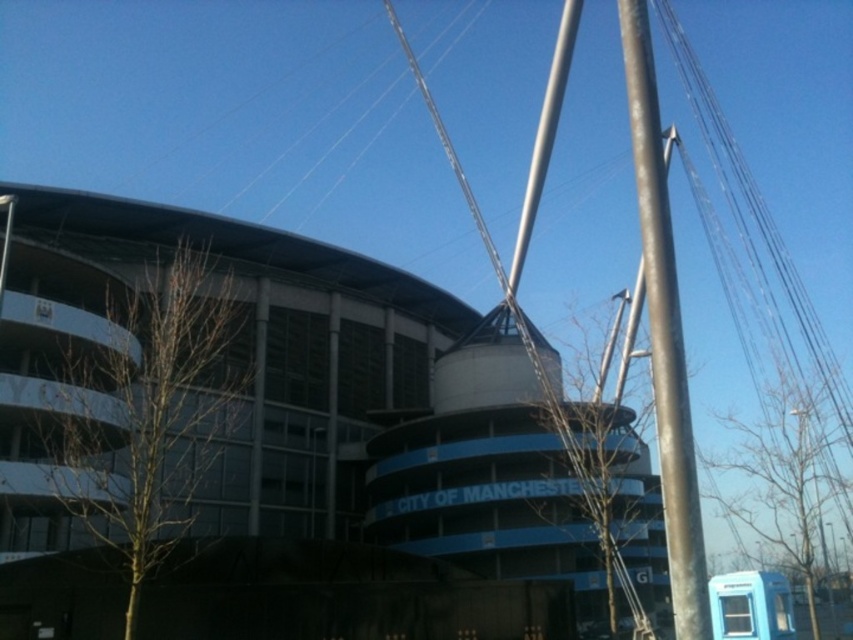
Question: Which of these objects is positioned farthest from the metallic pole at right?

Choices:
 (A) blue plastic bus stop at lower right
 (B) white concrete stadium at center

Answer: (B)

Question: Can you confirm if white concrete stadium at center is bigger than metallic pole at right?

Choices:
 (A) no
 (B) yes

Answer: (B)

Question: Considering the real-world distances, which object is closest to the metallic pole at right?

Choices:
 (A) blue plastic bus stop at lower right
 (B) white concrete stadium at center

Answer: (A)

Question: Does white concrete stadium at center appear on the right side of blue plastic bus stop at lower right?

Choices:
 (A) no
 (B) yes

Answer: (A)

Question: Which of the following is the closest to the observer?

Choices:
 (A) (657, 131)
 (B) (790, 604)

Answer: (A)

Question: In this image, where is metallic pole at right located relative to blue plastic bus stop at lower right?

Choices:
 (A) above
 (B) below

Answer: (A)